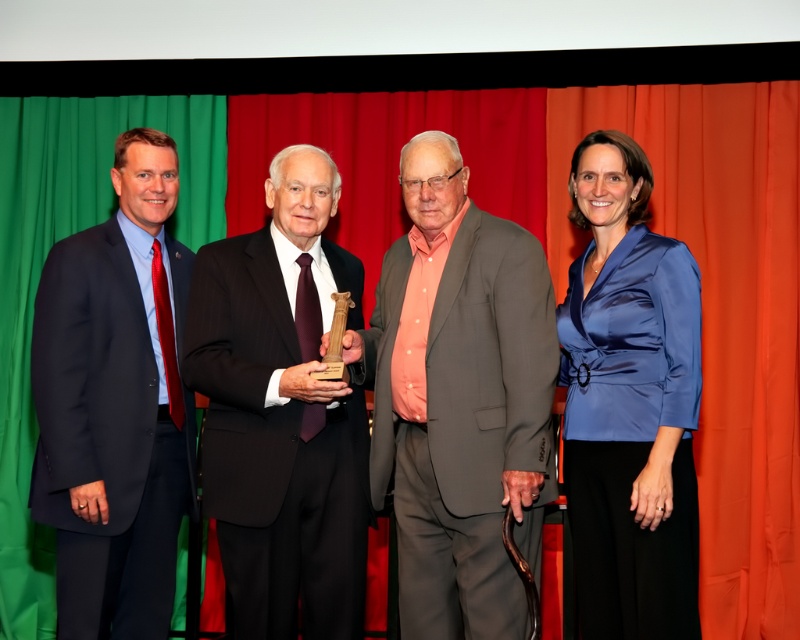
Looking at this image, you are a photographer positioned behind the group of people. You need to adjust your camera to capture both the gray fabric suit at center and the navy blue suit at left in a single shot. Given that your camera has a maximum focus range of 35 inches, will you be able to capture both subjects clearly?

The distance between the gray fabric suit at center and the navy blue suit at left is 34.92 inches, which is within the camera maximum focus range of 35 inches. Therefore, the photographer can capture both subjects clearly in a single shot.

You are a photographer at the event and need to adjust the lighting so that the gray fabric suit at center and the satin blue blouse at right are both well illuminated. Based on their positions, which one should you focus the light on first?

The gray fabric suit at center is located below the satin blue blouse at right, so you should focus the light on the satin blue blouse at right first to ensure it is properly lit before adjusting for the lower positioned gray fabric suit at center.